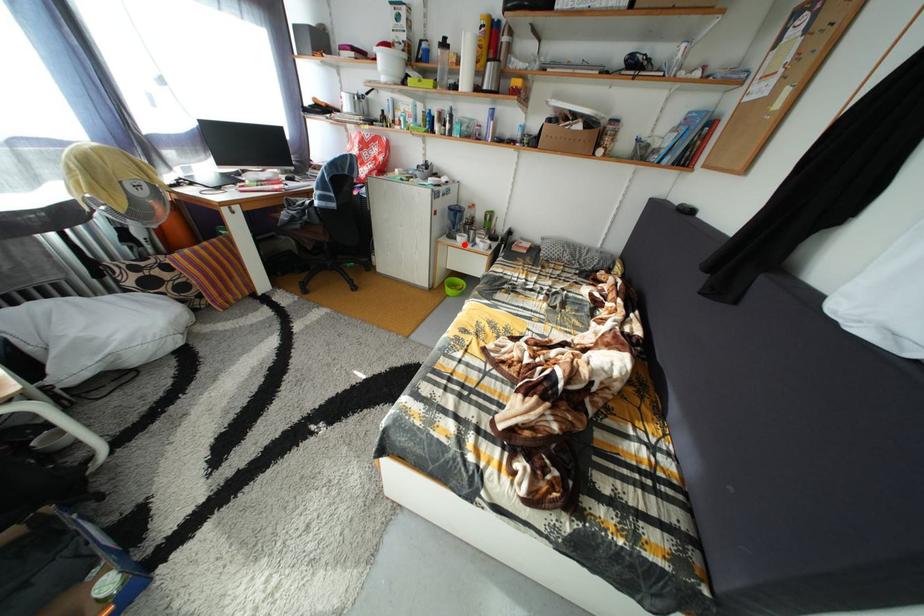
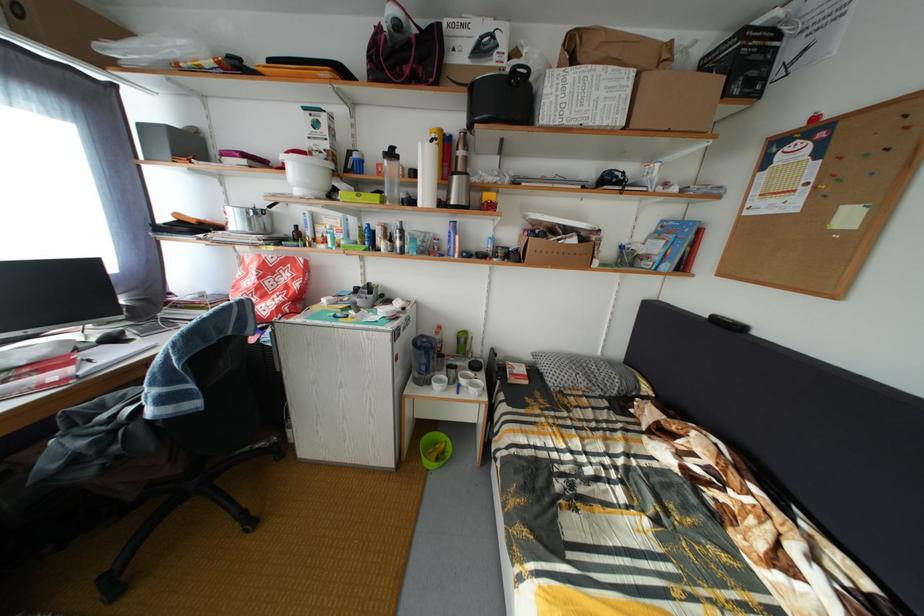
Find the pixel in the second image that matches the highlighted location in the first image.

(438, 390)